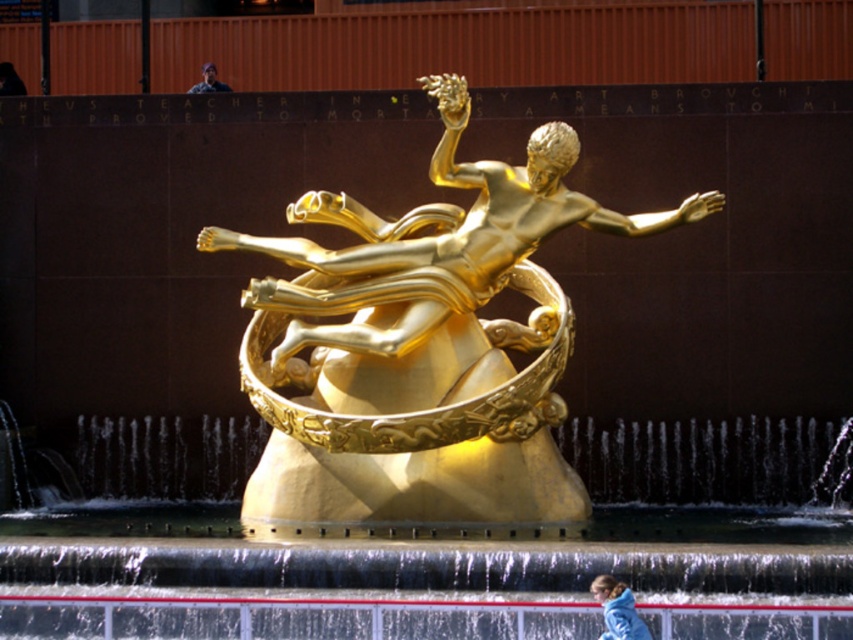
Question: Does blue fleece jacket at lower right have a smaller size compared to dark blue shirt at upper center?

Choices:
 (A) yes
 (B) no

Answer: (A)

Question: Which of these objects is positioned closest to the gold polished statue at center?

Choices:
 (A) dark blue shirt at upper center
 (B) dark blue fabric person at upper center

Answer: (A)

Question: Which object appears farthest from the camera in this image?

Choices:
 (A) gold polished statue at center
 (B) dark blue fabric person at upper center
 (C) blue fleece jacket at lower right

Answer: (B)

Question: Estimate the real-world distances between objects in this image. Which object is farther from the dark blue shirt at upper center?

Choices:
 (A) dark blue fabric person at upper center
 (B) gold polished statue at center
 (C) blue fleece jacket at lower right

Answer: (C)

Question: Is gold polished statue at center to the right of blue fleece jacket at lower right from the viewer's perspective?

Choices:
 (A) yes
 (B) no

Answer: (B)

Question: Is dark blue shirt at upper center above dark blue fabric person at upper center?

Choices:
 (A) yes
 (B) no

Answer: (A)